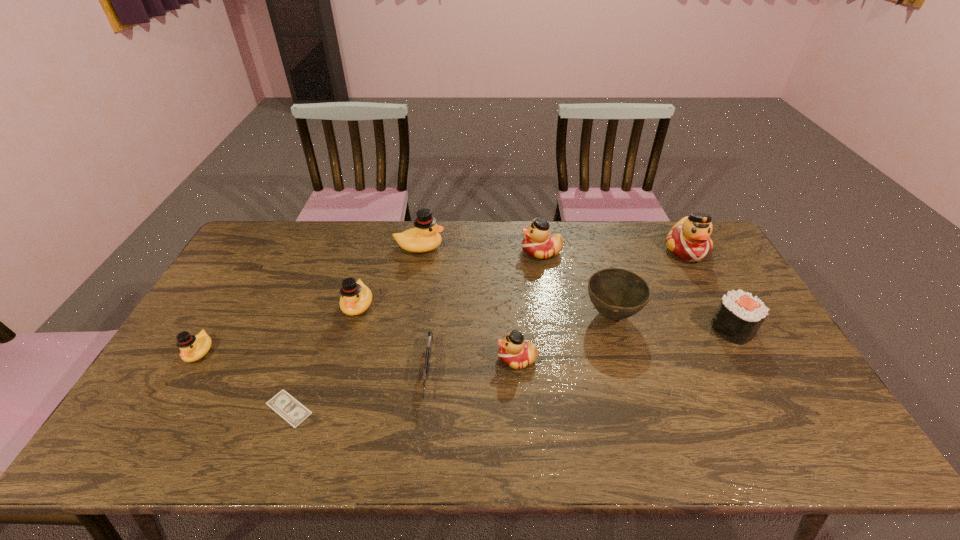
Identify the location of free space between the second biggest red duck and the eighth object from left to right. Image resolution: width=960 pixels, height=540 pixels. (576, 284).

This screenshot has height=540, width=960. In order to click on unoccupied position between the sushi and the smallest yellow duck in this screenshot , I will do `click(466, 340)`.

Locate an element on the screen. This screenshot has width=960, height=540. vacant area that lies between the nearest red duck and the grey gun is located at coordinates (472, 366).

Where is `vacant region between the money and the grey gun`? This screenshot has height=540, width=960. vacant region between the money and the grey gun is located at coordinates (358, 390).

The height and width of the screenshot is (540, 960). In order to click on free space between the rightmost duck and the second duck from left to right in this screenshot , I will do `click(522, 278)`.

The width and height of the screenshot is (960, 540). I want to click on free area in between the farthest yellow duck and the leftmost object, so click(309, 299).

Identify the location of vacant area that lies between the second smallest yellow duck and the smallest red duck. The width and height of the screenshot is (960, 540). (438, 332).

What are the coordinates of `the third closest object to the biggest red duck` in the screenshot? It's located at (538, 242).

Identify which object is the fifth nearest to the third duck from left to right. Please provide its 2D coordinates. Your answer should be formatted as a tuple, i.e. [(x, y)], where the tuple contains the x and y coordinates of a point satisfying the conditions above.

[(617, 294)]

Find the location of a particular element. This screenshot has height=540, width=960. duck object that ranks as the second closest to the smallest yellow duck is located at coordinates (425, 237).